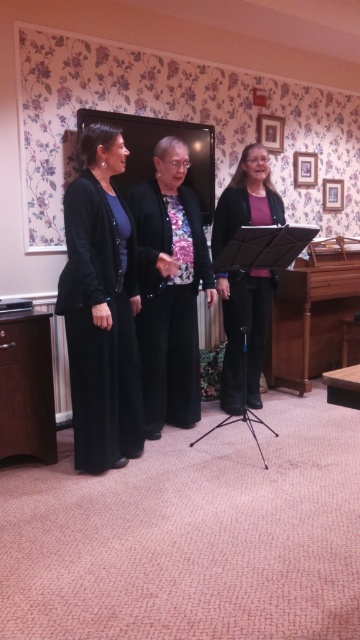
Question: Which of the following is the farthest from the observer?

Choices:
 (A) black matte suit at left
 (B) black matte blazer at center

Answer: (B)

Question: Is black matte blazer at center thinner than matte black jacket at center?

Choices:
 (A) yes
 (B) no

Answer: (B)

Question: Can you confirm if black matte blazer at center is positioned above matte black jacket at center?

Choices:
 (A) no
 (B) yes

Answer: (A)

Question: Which of the following is the closest to the observer?

Choices:
 (A) (240, 296)
 (B) (108, 467)

Answer: (B)

Question: Which object appears closest to the camera in this image?

Choices:
 (A) black matte suit at left
 (B) matte black jacket at center
 (C) black matte blazer at center

Answer: (A)

Question: Does black matte suit at left have a greater width compared to matte black jacket at center?

Choices:
 (A) no
 (B) yes

Answer: (A)